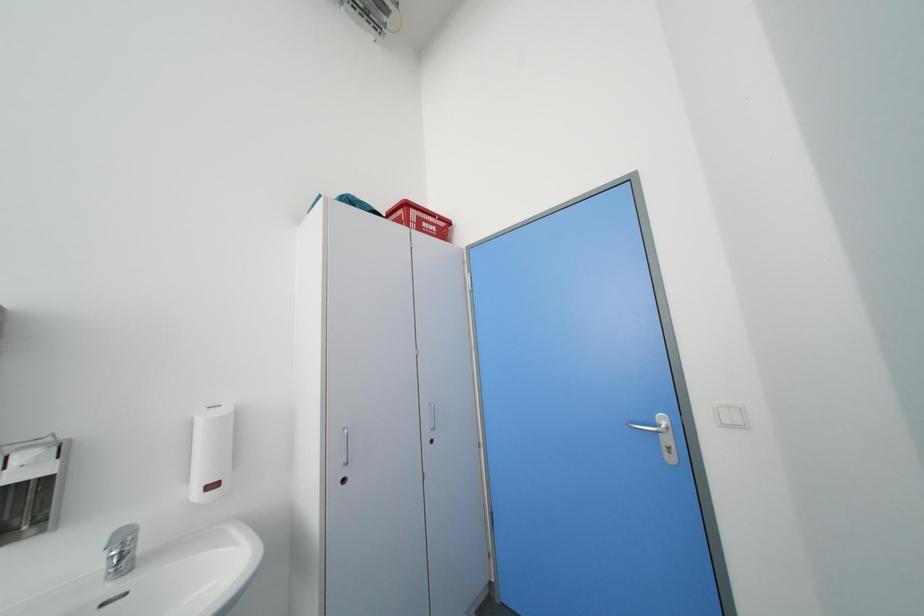
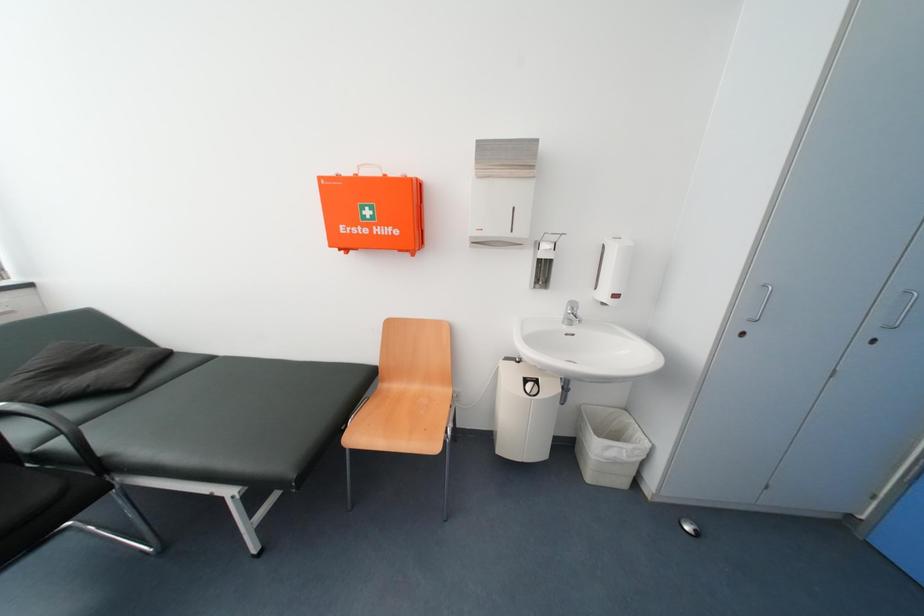
How did the camera likely rotate?

The camera rotated toward left-down.